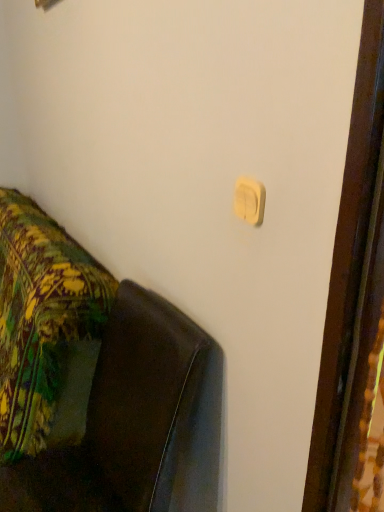
Question: Does white matte light switch at upper center touch leather couch at lower left?

Choices:
 (A) yes
 (B) no

Answer: (B)

Question: Does white matte light switch at upper center turn towards leather couch at lower left?

Choices:
 (A) no
 (B) yes

Answer: (A)

Question: From a real-world perspective, is white matte light switch at upper center physically above leather couch at lower left?

Choices:
 (A) no
 (B) yes

Answer: (B)

Question: Is white matte light switch at upper center turned away from leather couch at lower left?

Choices:
 (A) no
 (B) yes

Answer: (A)

Question: Is white matte light switch at upper center further to the viewer compared to leather couch at lower left?

Choices:
 (A) no
 (B) yes

Answer: (B)

Question: From the image's perspective, does white matte light switch at upper center appear lower than leather couch at lower left?

Choices:
 (A) no
 (B) yes

Answer: (A)

Question: Is leather couch at lower left closer to camera compared to white matte light switch at upper center?

Choices:
 (A) no
 (B) yes

Answer: (B)

Question: From a real-world perspective, is leather couch at lower left on white matte light switch at upper center?

Choices:
 (A) yes
 (B) no

Answer: (B)

Question: From the image's perspective, is leather couch at lower left on top of white matte light switch at upper center?

Choices:
 (A) no
 (B) yes

Answer: (A)

Question: Does leather couch at lower left have a greater width compared to white matte light switch at upper center?

Choices:
 (A) yes
 (B) no

Answer: (A)

Question: Is leather couch at lower left placed right next to white matte light switch at upper center?

Choices:
 (A) no
 (B) yes

Answer: (A)

Question: Is leather couch at lower left positioned behind white matte light switch at upper center?

Choices:
 (A) no
 (B) yes

Answer: (A)

Question: Is leather couch at lower left inside or outside of white matte light switch at upper center?

Choices:
 (A) outside
 (B) inside

Answer: (A)